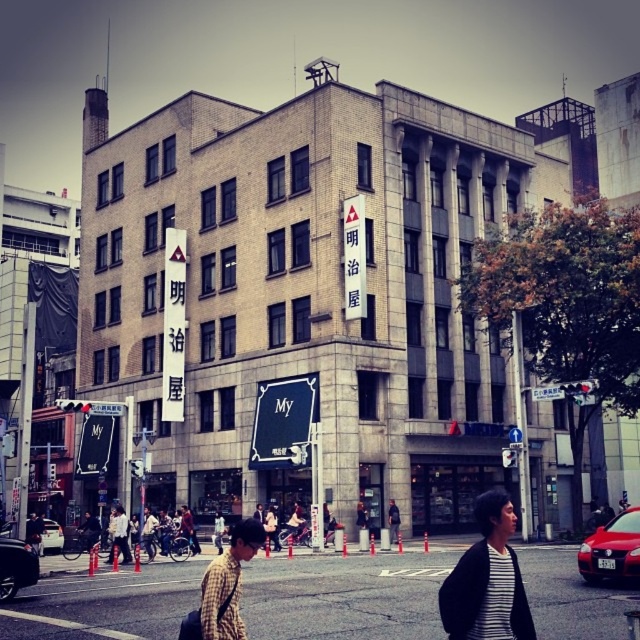
Question: Is plaid fabric shirt at center positioned before white plastic street sign at center?

Choices:
 (A) no
 (B) yes

Answer: (B)

Question: Considering the real-world distances, which object is closest to the plaid fabric shirt at center?

Choices:
 (A) white plastic street sign at center
 (B) striped cotton shirt at center

Answer: (B)

Question: Does plaid fabric shirt at center lie behind white plastic street sign at center?

Choices:
 (A) no
 (B) yes

Answer: (A)

Question: Is plaid fabric shirt at center thinner than white plastic street sign at center?

Choices:
 (A) no
 (B) yes

Answer: (A)

Question: Among these objects, which one is farthest from the camera?

Choices:
 (A) plaid fabric shirt at center
 (B) striped cotton shirt at center

Answer: (A)

Question: Which object appears farthest from the camera in this image?

Choices:
 (A) striped cotton shirt at center
 (B) white plastic street sign at center

Answer: (B)